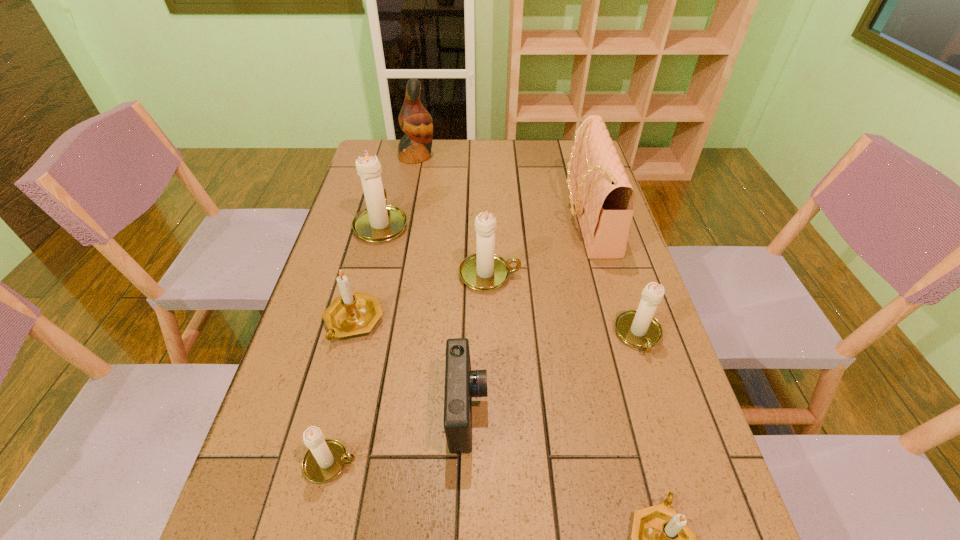
Locate which candle holder ranks fifth in proximity to the blue camera. Please provide its 2D coordinates. Your answer should be formatted as a tuple, i.e. [(x, y)], where the tuple contains the x and y coordinates of a point satisfying the conditions above.

[(638, 328)]

Select which candle holder is the third closest to the nearest candle holder. Please provide its 2D coordinates. Your answer should be formatted as a tuple, i.e. [(x, y)], where the tuple contains the x and y coordinates of a point satisfying the conditions above.

[(483, 271)]

Find the location of a particular element. white candle holder that is the fourth closest one to the right gold candle holder is located at coordinates (379, 222).

Image resolution: width=960 pixels, height=540 pixels. In order to click on white candle holder that can be found as the third closest to the nearest white candle holder in this screenshot , I will do `click(379, 222)`.

At what (x,y) coordinates should I click in order to perform the action: click on free point that satisfies the following two spatial constraints: 1. on the handle side of the third nearest white candle holder; 2. on the front side of the bigger gold candle holder. Please return your answer as a coordinate pair (x, y). This screenshot has width=960, height=540. Looking at the image, I should click on (491, 321).